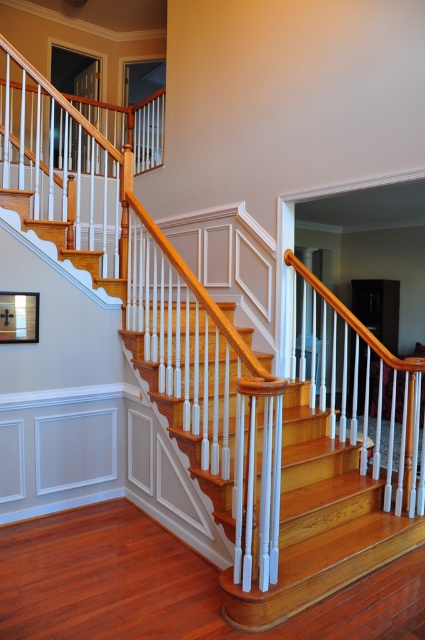
You are moving a large painting that is 1.2 meters wide and need to pass through the staircase area. Given the light brown wood stairs at center and the matte black picture frame at upper left, which object do you think the painting might not fit through and why?

The painting might not fit through the matte black picture frame at upper left because the light brown wood stairs at center are wider than the matte black picture frame at upper left, making the frame a narrower passage.

You are standing at the bottom of the light brown wood stairs at center and want to hang a decorative hook on the matte black picture frame at upper left. Considering your current position, can you reach the frame without climbing the stairs?

The light brown wood stairs at center is closer to the viewer than matte black picture frame at upper left, so the frame is further away. However, since you are at the bottom of the stairs, you might still be able to reach the frame if it is within arm s reach from your current position. If not, you may need to climb the stairs to reach it.

You are standing at the bottom of the staircase and want to hang a new picture frame on the wall. The current matte black picture frame at upper left is already hanging there. If you want to place a new frame to the right of the existing one, will it be positioned in the same area as the light brown wood stairs at center?

The light brown wood stairs at center is already to the right of the matte black picture frame at upper left, so placing a new frame to the right of the existing one would align it with the area where the light brown wood stairs at center are located. Therefore, the new frame would be positioned in the same area as the light brown wood stairs at center.